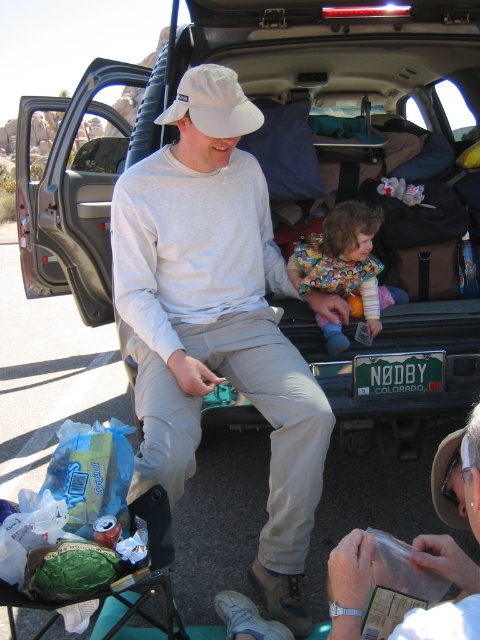
Is matte black truck at center above white fabric baseball cap at center?

Indeed, matte black truck at center is positioned over white fabric baseball cap at center.

Can you confirm if matte black truck at center is taller than white fabric baseball cap at center?

Correct, matte black truck at center is much taller as white fabric baseball cap at center.

Who is more forward, (58, 292) or (197, 113)?

Point (197, 113) is more forward.

Identify the location of matte black truck at center. This screenshot has height=640, width=480. (260, 108).

Between point (277, 342) and point (201, 129), which one is positioned behind?

The point (277, 342) is behind.

Can you confirm if white matte hat at upper center is taller than white fabric baseball cap at center?

Indeed, white matte hat at upper center has a greater height compared to white fabric baseball cap at center.

Is point (197, 204) positioned in front of point (176, 108)?

No, it is behind (176, 108).

You are a GUI agent. You are given a task and a screenshot of the screen. Output one action in this format:
    pyautogui.click(x=<x>, y=<y>)
    Task: Click on the white matte hat at upper center
    The width and height of the screenshot is (480, 640).
    Given the screenshot: What is the action you would take?
    pyautogui.click(x=216, y=320)

Which is behind, point (377, 129) or point (316, 278)?

Positioned behind is point (377, 129).

Does point (103, 196) come behind point (348, 243)?

Yes, it is.

Identify the location of matte black truck at center. (260, 108).